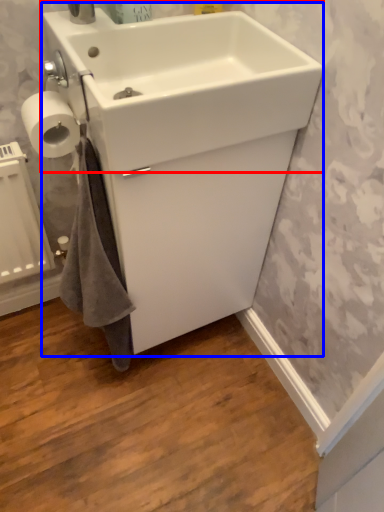
Question: Which object appears farthest to the camera in this image, sink (highlighted by a red box) or sink (highlighted by a blue box)?

Choices:
 (A) sink
 (B) sink

Answer: (B)